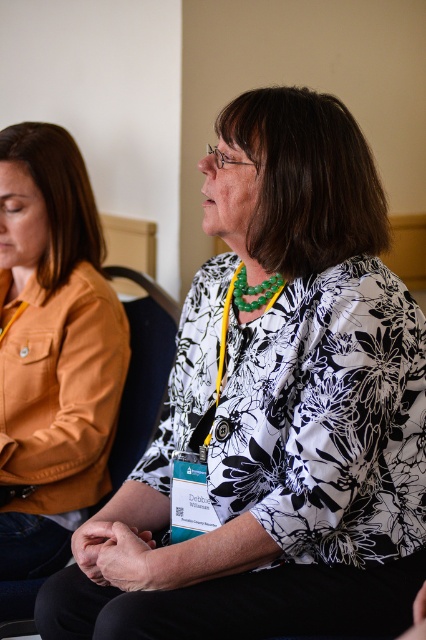
Between point (63, 340) and point (152, 374), which one is positioned in front?

Positioned in front is point (63, 340).

Can you confirm if matte orange jacket at left is positioned below black fabric chair at center?

No.

The width and height of the screenshot is (426, 640). I want to click on matte orange jacket at left, so click(51, 348).

This screenshot has width=426, height=640. What are the coordinates of `matte orange jacket at left` in the screenshot? It's located at (51, 348).